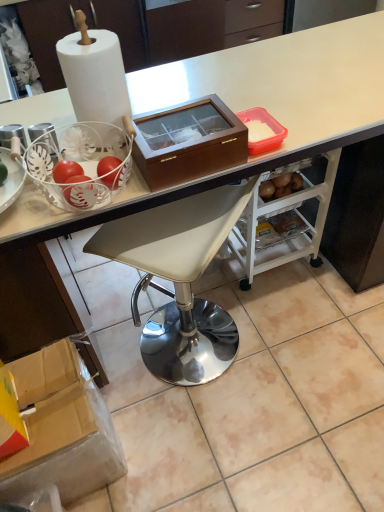
Identify the location of vacant region in front of white glossy desk at upper center. The image size is (384, 512). (281, 406).